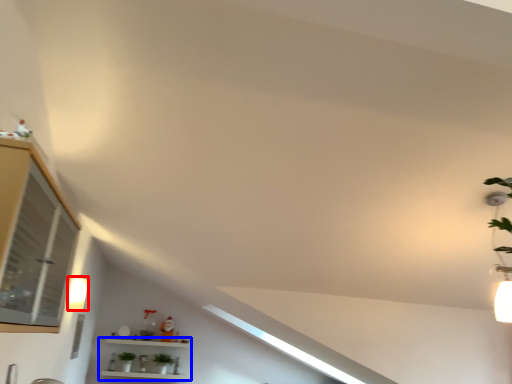
Question: Which object is further to the camera taking this photo, light fixture (highlighted by a red box) or shelf (highlighted by a blue box)?

Choices:
 (A) light fixture
 (B) shelf

Answer: (B)